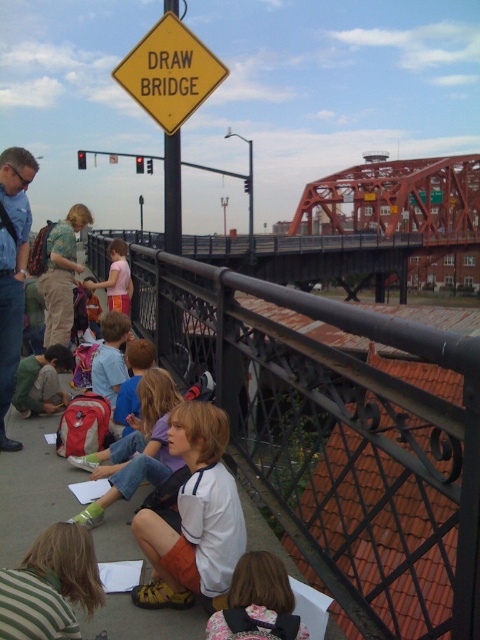
You are a painter who wants to paint the orange steel bridge at center and the striped fabric shirt at lower left. Which object should you focus on first if you want to paint from top to bottom?

The orange steel bridge at center is much taller than the striped fabric shirt at lower left, so you should paint the orange steel bridge at center first from top to bottom.

You are a painter wanting to capture the scene of the children on the bridge. You notice the black metal railing at center and the striped fabric shirt at lower left. Which object should you focus on if you want to paint something wider in the scene?

The black metal railing at center is wider than the striped fabric shirt at lower left, so you should focus on painting the black metal railing at center.